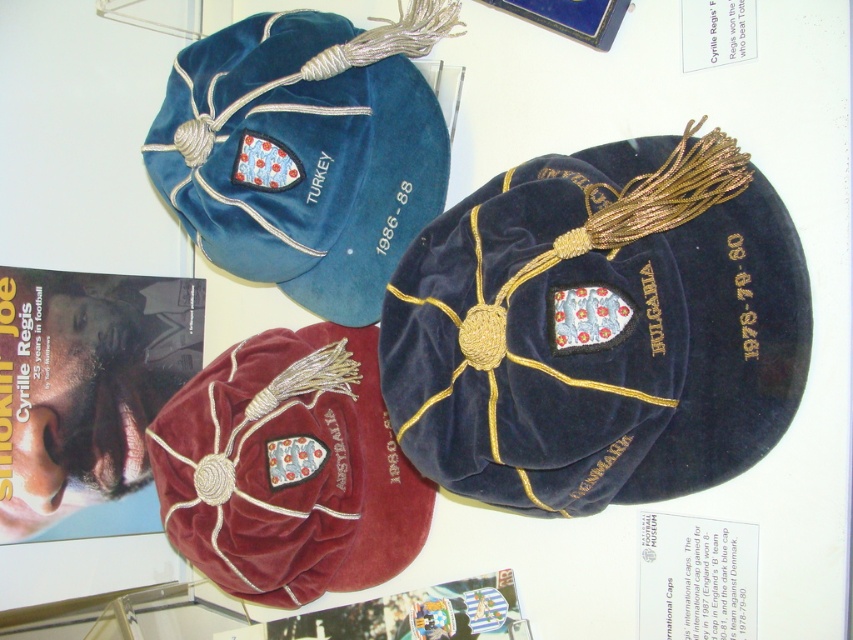
Can you confirm if velvet blue cap at upper left is taller than maroon velvet cap at center?

Yes.

Does velvet blue cap at upper left appear under maroon velvet cap at center?

No.

Does point (209, 74) come closer to viewer compared to point (277, 348)?

Yes, it is in front of point (277, 348).

The height and width of the screenshot is (640, 853). Identify the location of velvet blue cap at upper left. (305, 150).

Who is more forward, (502, 280) or (200, 166)?

Point (502, 280)

Can you confirm if velvet cap at center is positioned above velvet blue cap at upper left?

No.

Is point (601, 436) positioned after point (364, 211)?

No, (601, 436) is in front of (364, 211).

I want to click on velvet cap at center, so click(599, 328).

Does velvet cap at center have a lesser height compared to maroon velvet cap at center?

No.

This screenshot has width=853, height=640. I want to click on velvet cap at center, so click(x=599, y=328).